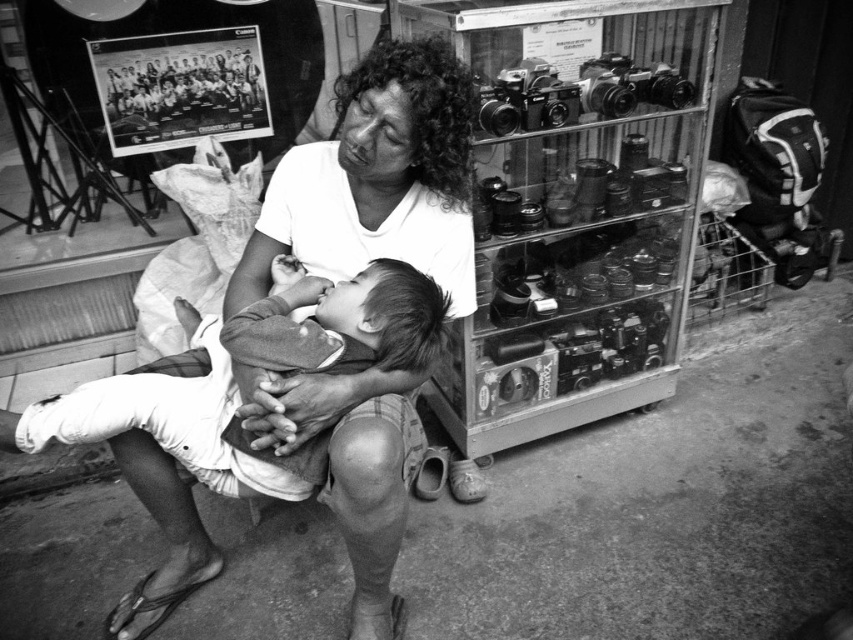
You are a photographer trying to capture a closeup of the white cotton shirt at center and the soft cotton baby at center. Since the camera lens is only 3 cm thick, will both objects fit within the lens without overlapping?

The white cotton shirt at center is thinner than the soft cotton baby at center, but the total combined thickness of both objects would still exceed the 3 cm lens capacity. They cannot fit without overlapping.